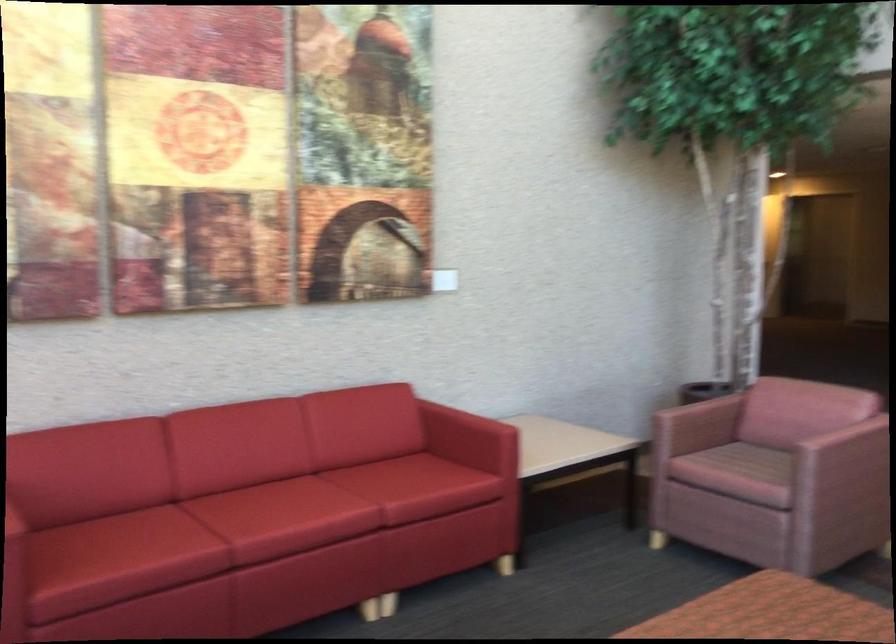
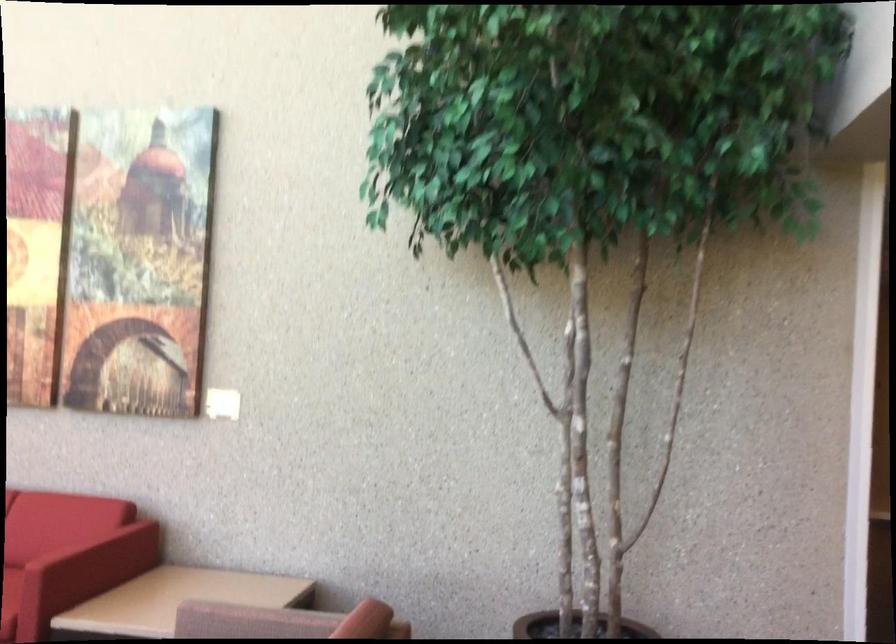
In the second image, find the point that corresponds to [419,422] in the first image.

(80, 540)